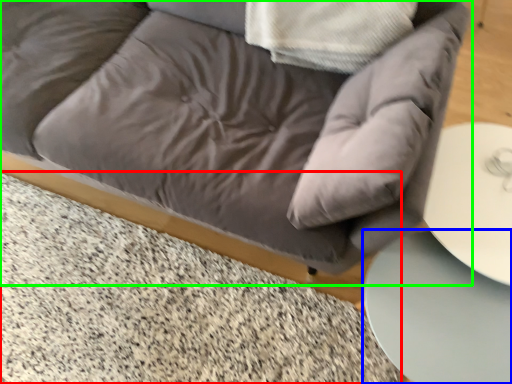
Question: Which is farther away from marble (highlighted by a red box)? table (highlighted by a blue box) or studio couch (highlighted by a green box)?

Choices:
 (A) table
 (B) studio couch

Answer: (A)